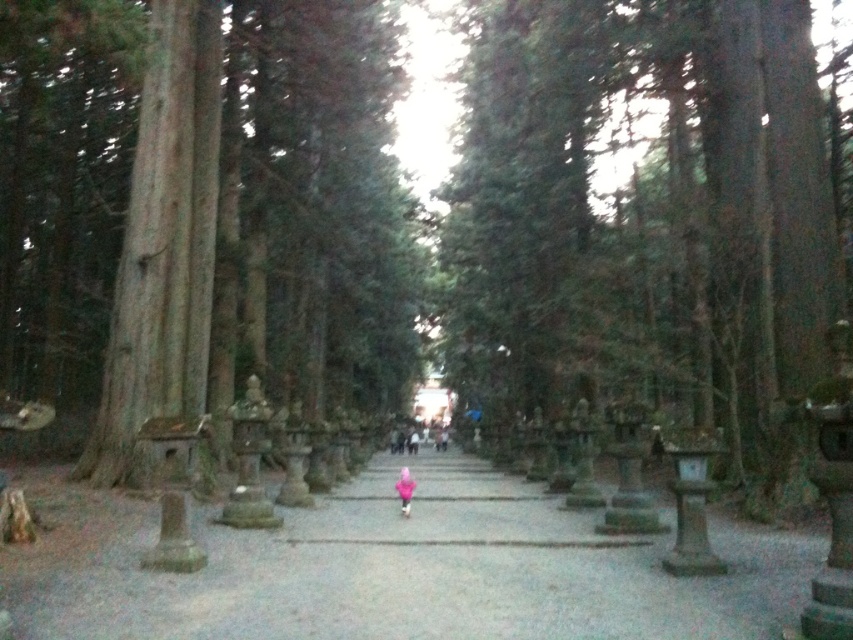
Looking at this image, who is lower down, gray stone path at center or pink fabric child at center?

Positioned lower is pink fabric child at center.

Is point (750, 605) farther from viewer compared to point (399, 499)?

No, it is not.

Locate an element on the screen. gray stone path at center is located at coordinates (405, 570).

Who is positioned more to the right, green textured stone at center or pink fabric child at center?

green textured stone at center is more to the right.

Is green textured stone at center bigger than pink fabric child at center?

Yes, green textured stone at center is bigger than pink fabric child at center.

Locate an element on the screen. This screenshot has height=640, width=853. green textured stone at center is located at coordinates (643, 216).

Looking at this image, is smooth brown tree trunk at left closer to camera compared to pink fabric at center?

Yes, it is in front of pink fabric at center.

Does smooth brown tree trunk at left appear over pink fabric at center?

Yes.

Does point (166, 168) lie behind point (413, 426)?

No, (166, 168) is closer to viewer.

Where is `smooth brown tree trunk at left`? smooth brown tree trunk at left is located at coordinates (164, 241).